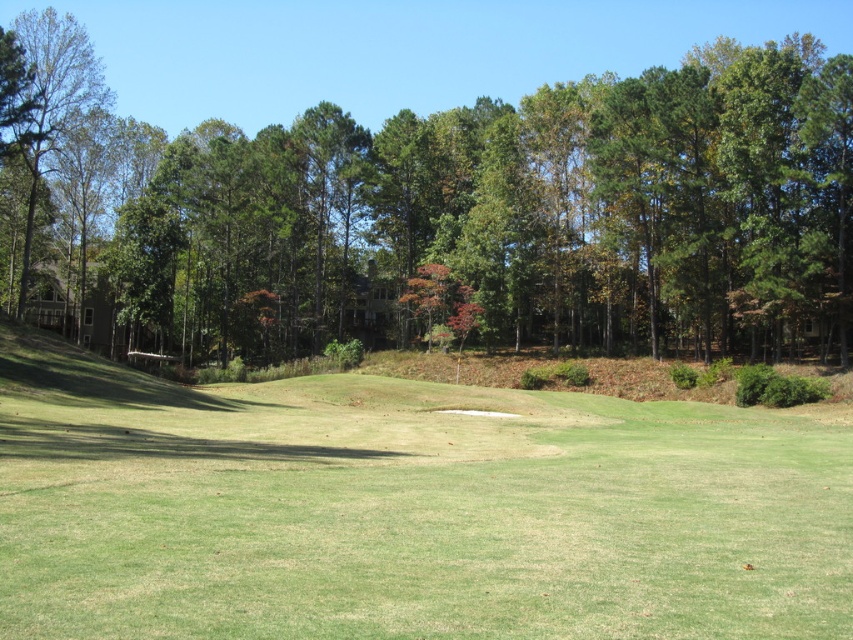
You are standing on the golf course and see the green grassy field at center and the green leafy tree at center. Which object is nearer to you?

The green grassy field at center is closer to the viewer than the green leafy tree at center.

Consider the image. You are standing on the golf course and see two points marked on the fairway. The first point is at coordinates point (140,442) and the second is at point (732,289). Which point is closer to you?

Point (140,442) is closer to the viewer than point (732,289).